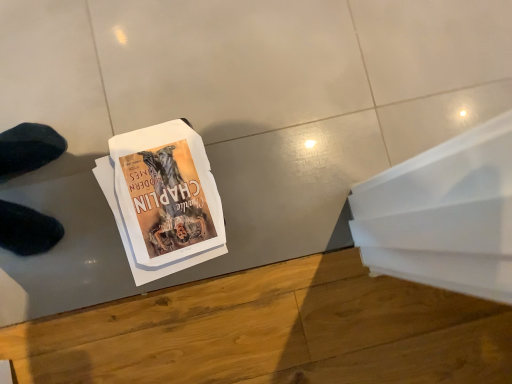
Where is `vacant location behind matte paper book at center`? vacant location behind matte paper book at center is located at coordinates pos(206,92).